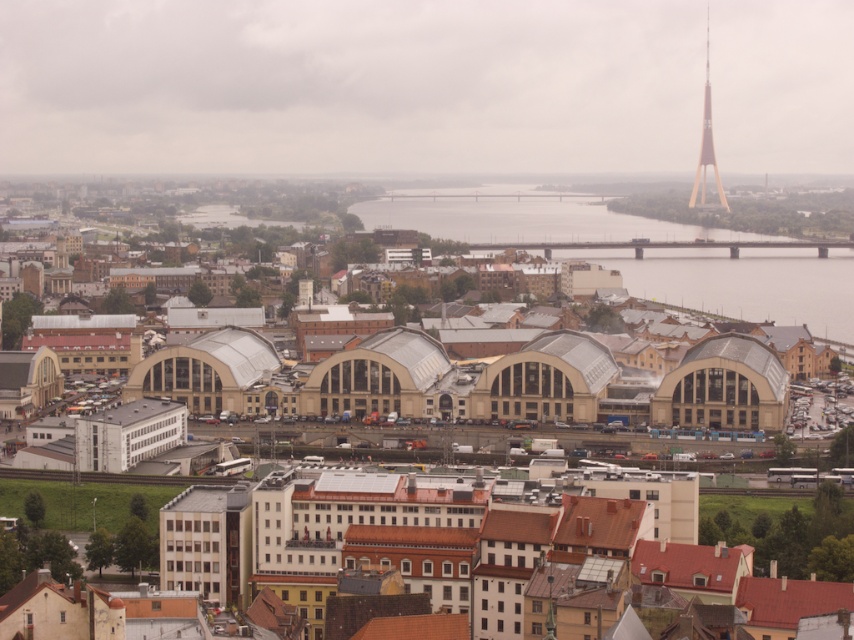
You are a drone operator trying to land a drone on a flat surface in the city. You see the gray concrete water at center. Can you land the drone there?

The gray concrete water at center is a body of water, not a solid surface, so the drone cannot land there.

You are a drone operator who needs to deliver a package to the metallic gold tower at upper right. From your current position above the gray concrete water at center, which direction should you fly to reach the tower?

The gray concrete water at center is below the metallic gold tower at upper right, so you should fly upward and toward the upper right direction to reach the metallic gold tower at upper right.